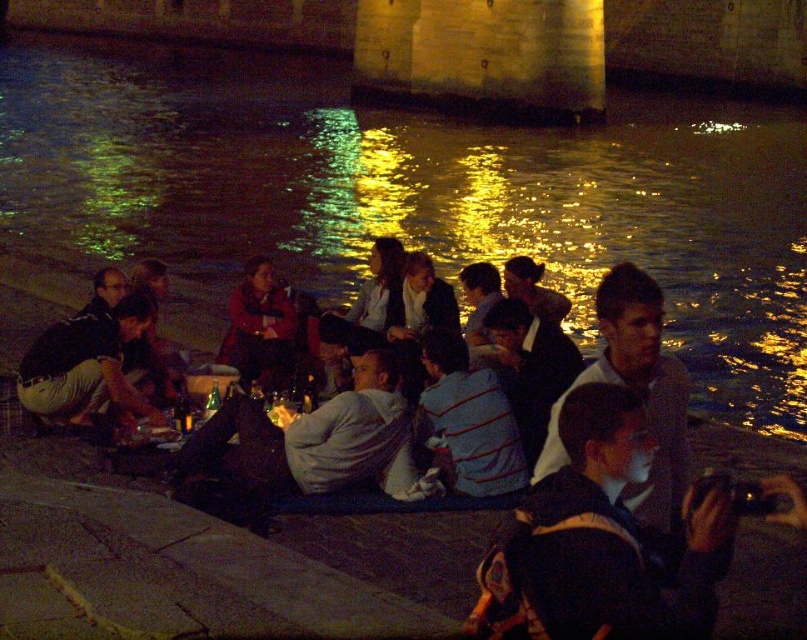
You are standing at the edge of the waterfront scene. You notice the light brown leather jacket at lower left and the matte red jacket at center. Which jacket is positioned lower in the image?

The light brown leather jacket at lower left is positioned lower in the image than the matte red jacket at center, as it is located below it.

You are standing at the center of the waterfront scene. There is a black fabric jacket at lower right. Can you see the point located at coordinate (605,540) on the black fabric jacket at lower right from your current position?

Yes, the point located at coordinate (605,540) is on the black fabric jacket at lower right, so you can see it from your current position at the center of the waterfront scene.

Looking at this image, you are standing at the waterfront and want to hand a drink to both the person wearing the light brown leather jacket at lower left and the person wearing the matte red jacket at center. Which jacket is closer to you so you can reach them first without moving?

The light brown leather jacket at lower left is closer to the viewer than the matte red jacket at center, so you can reach them first by approaching the light brown leather jacket at lower left.